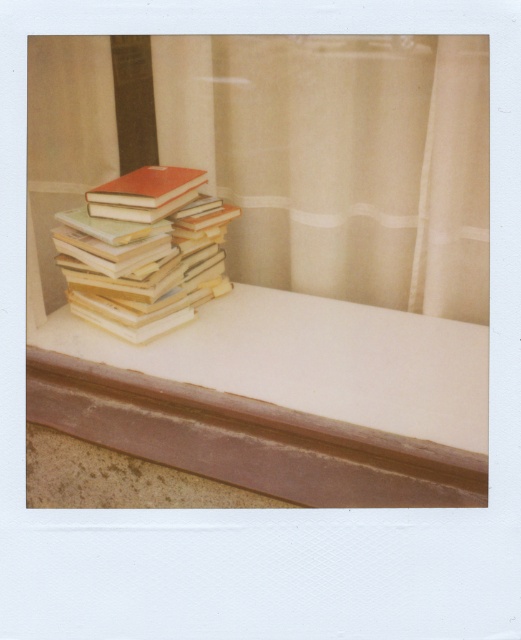
Is point (106, 134) closer to viewer compared to point (152, 212)?

That is False.

You are a GUI agent. You are given a task and a screenshot of the screen. Output one action in this format:
    pyautogui.click(x=<x>, y=<y>)
    Task: Click on the sheer beige curtain at upper center
    The image size is (521, 640).
    Given the screenshot: What is the action you would take?
    pyautogui.click(x=287, y=154)

Between point (449, 250) and point (219, 205), which one is positioned behind?

Positioned behind is point (219, 205).

You are a GUI agent. You are given a task and a screenshot of the screen. Output one action in this format:
    pyautogui.click(x=<x>, y=<y>)
    Task: Click on the sheer beige curtain at upper center
    This screenshot has width=521, height=640.
    Given the screenshot: What is the action you would take?
    pyautogui.click(x=287, y=154)

Between sheer beige curtain at upper center and white smooth window sill at center, which one appears on the left side from the viewer's perspective?

From the viewer's perspective, sheer beige curtain at upper center appears more on the left side.

Is sheer beige curtain at upper center closer to the viewer compared to white smooth window sill at center?

No, it is behind white smooth window sill at center.

Is point (287, 192) farther from camera compared to point (368, 356)?

Yes.

This screenshot has width=521, height=640. I want to click on sheer beige curtain at upper center, so click(287, 154).

Is white smooth window sill at center bigger than matte orange book at center?

Yes.

Does white smooth window sill at center have a lesser width compared to matte orange book at center?

In fact, white smooth window sill at center might be wider than matte orange book at center.

At what (x,y) coordinates should I click in order to perform the action: click on white smooth window sill at center. Please return your answer as a coordinate pair (x, y). Looking at the image, I should click on (282, 397).